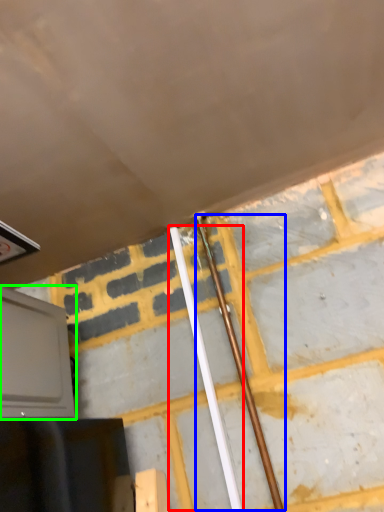
Question: Which object is the closest to the beam (highlighted by a red box)? Choose among these: beam (highlighted by a blue box) or oven (highlighted by a green box).

Choices:
 (A) beam
 (B) oven

Answer: (A)